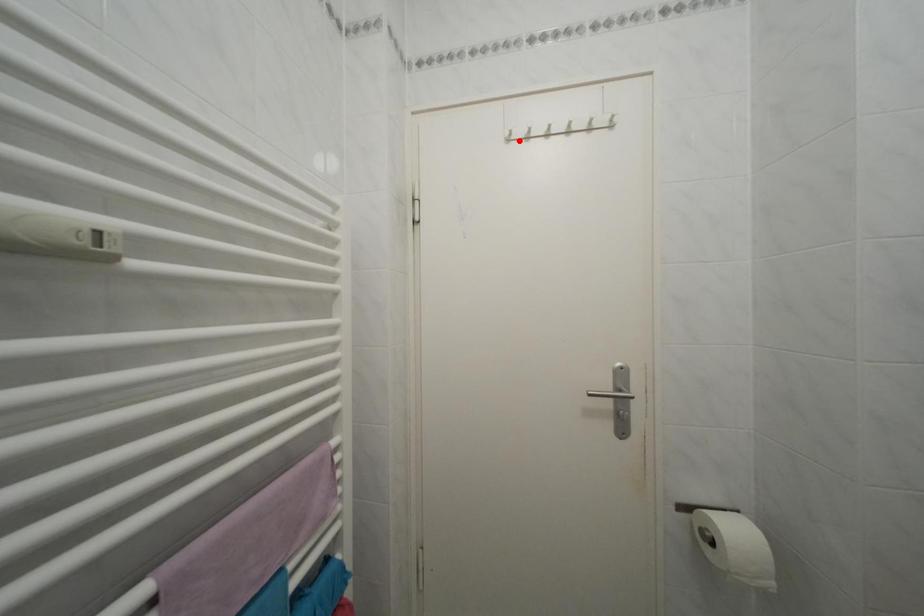
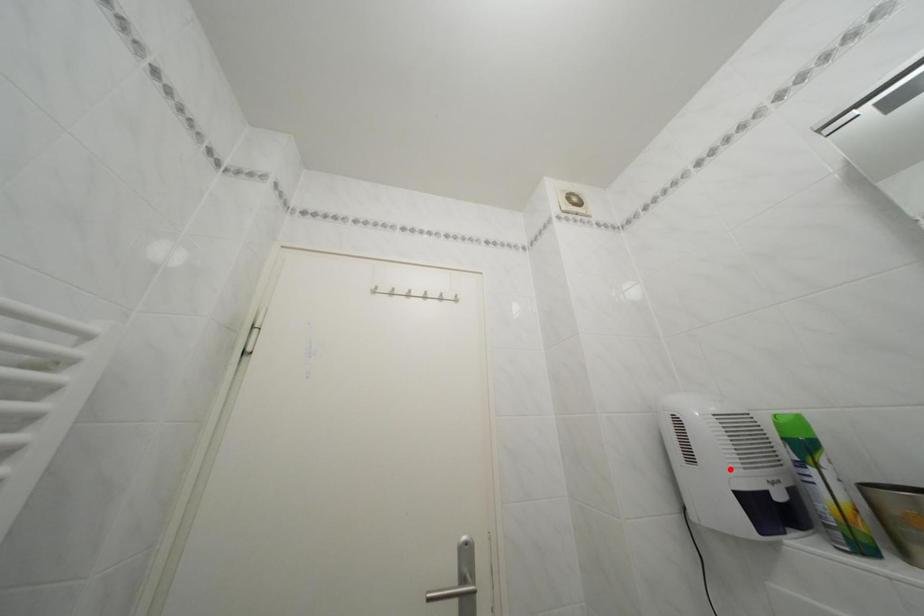
I am providing you with two images of the same scene from different viewpoints. A red point is marked on the first image and another point is marked on the second image. Does the point marked in image1 correspond to the same location as the one in image2?

No